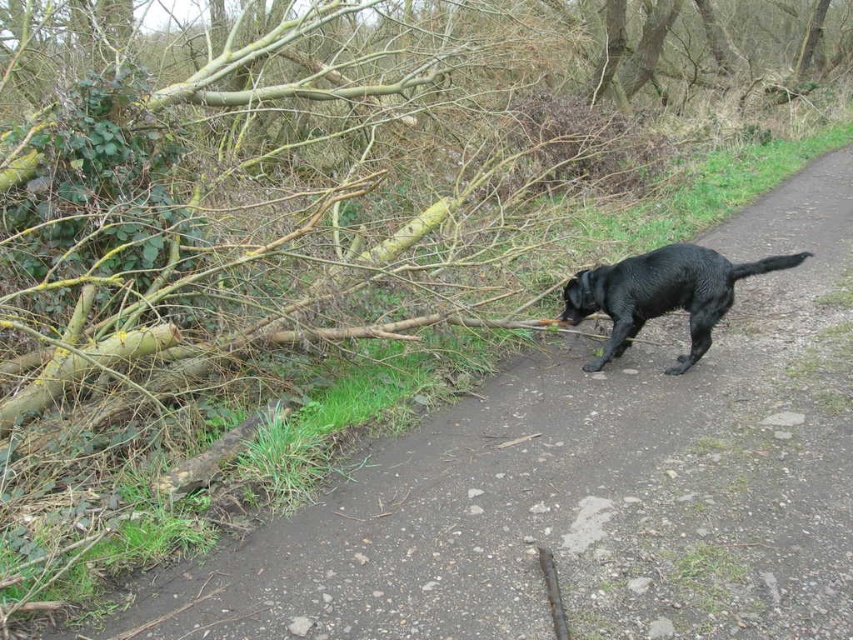
Question: Which object is farther from the camera taking this photo?

Choices:
 (A) brown wood log at left
 (B) shiny black dog at center-right

Answer: (B)

Question: Is brown wood log at left in front of shiny black dog at center-right?

Choices:
 (A) yes
 (B) no

Answer: (A)

Question: Can you confirm if brown wood log at left is thinner than shiny black dog at center-right?

Choices:
 (A) yes
 (B) no

Answer: (B)

Question: Can you confirm if brown wood log at left is bigger than shiny black dog at center-right?

Choices:
 (A) no
 (B) yes

Answer: (B)